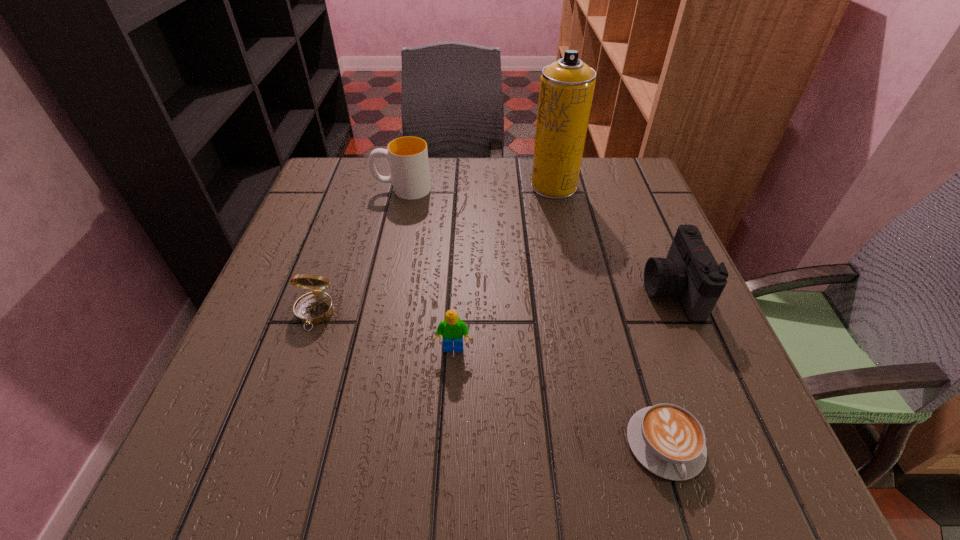
You are a GUI agent. You are given a task and a screenshot of the screen. Output one action in this format:
    pyautogui.click(x=<x>, y=<y>)
    Task: Click on the tallest object
    
    Given the screenshot: What is the action you would take?
    pyautogui.click(x=567, y=86)

The image size is (960, 540). Identify the location of cup. (408, 156).

At what (x,y) coordinates should I click in order to perform the action: click on camera. Please return your answer as a coordinate pair (x, y). The width and height of the screenshot is (960, 540). Looking at the image, I should click on (690, 272).

Locate an element on the screen. The image size is (960, 540). the second nearest object is located at coordinates click(452, 329).

At what (x,y) coordinates should I click in order to perform the action: click on Lego. Please return your answer as a coordinate pair (x, y). This screenshot has width=960, height=540. Looking at the image, I should click on (452, 329).

Identify the location of the leftmost object. (315, 307).

Locate an element on the screen. the nearest object is located at coordinates (666, 439).

I want to click on the shortest object, so click(x=666, y=439).

In order to click on free location located on the front of the tallest object in this screenshot , I will do click(x=564, y=237).

The width and height of the screenshot is (960, 540). Find the location of `vacant area located with the handle on the side of the second object from left to right`. vacant area located with the handle on the side of the second object from left to right is located at coordinates pos(314,189).